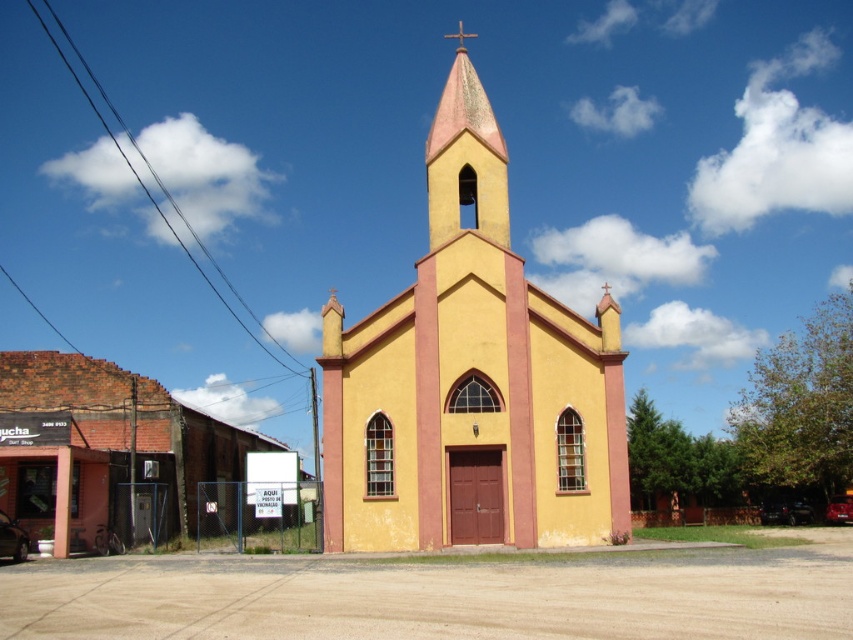
Which is more to the left, brick building at lower left or pink matte steeple at center?

From the viewer's perspective, brick building at lower left appears more on the left side.

Does brick building at lower left have a larger size compared to pink matte steeple at center?

No, brick building at lower left is not bigger than pink matte steeple at center.

Is point (74, 417) closer to camera compared to point (457, 192)?

No, (74, 417) is further to viewer.

Image resolution: width=853 pixels, height=640 pixels. I want to click on brick building at lower left, so point(106,451).

Does yellow matte church at center appear on the right side of pink matte steeple at center?

Yes, yellow matte church at center is to the right of pink matte steeple at center.

Between point (480, 237) and point (492, 218), which one is positioned in front?

Point (480, 237) is more forward.

Is point (444, 484) more distant than point (492, 182)?

No, (444, 484) is in front of (492, 182).

Locate an element on the screen. This screenshot has width=853, height=640. yellow matte church at center is located at coordinates (471, 380).

Is point (461, 401) less distant than point (51, 518)?

Yes.

Is point (514, 323) positioned after point (212, 461)?

No, (514, 323) is in front of (212, 461).

Identify the location of yellow matte church at center. (471, 380).